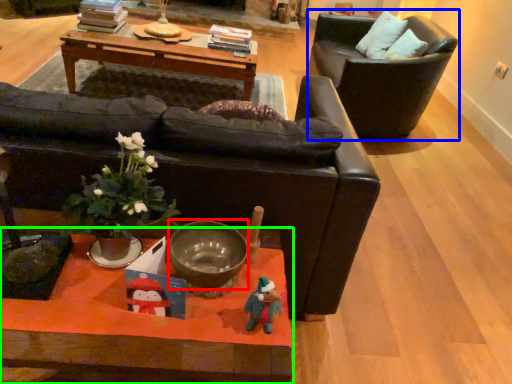
Question: Which is nearer to the bowl (highlighted by a red box)? chair (highlighted by a blue box) or coffee table (highlighted by a green box).

Choices:
 (A) chair
 (B) coffee table

Answer: (B)